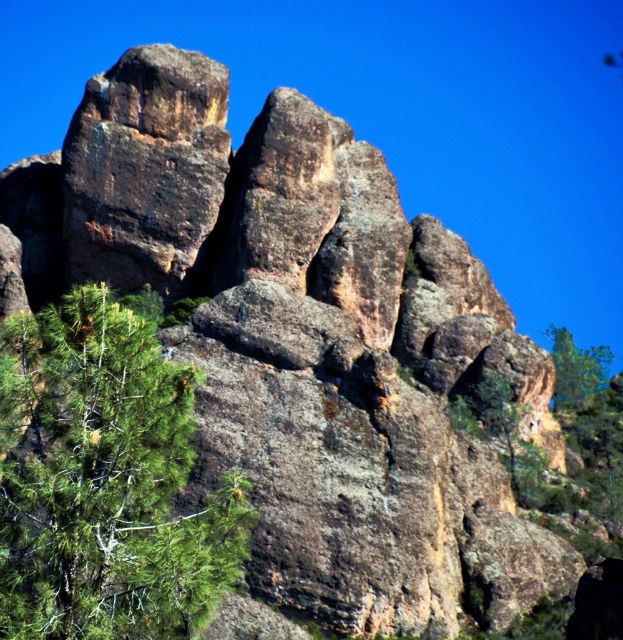
You are standing in the rocky landscape and want to take a photo of both the green leafy tree at lower left and the green leafy tree at upper right. Which tree should you focus on first to ensure both are in sharp focus?

You should focus on the green leafy tree at lower left first because it is closer to you than the green leafy tree at upper right. By focusing on the closer tree, the farther one will also be in focus due to the depth of field.